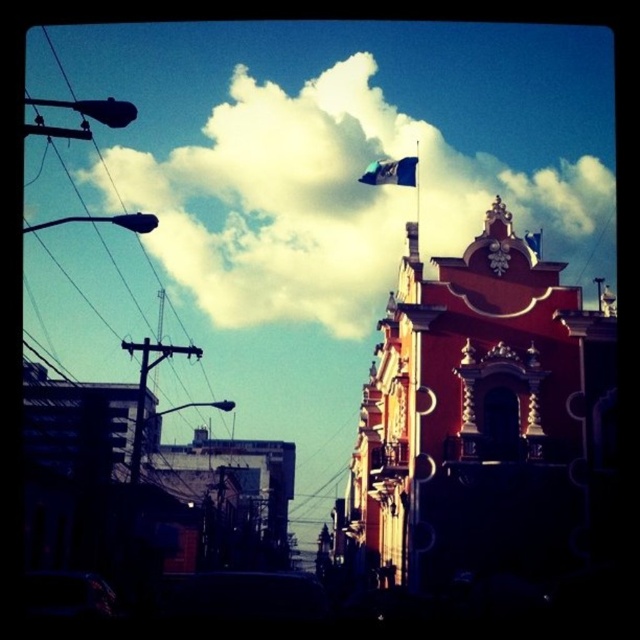
Question: Which of the following is the closest to the observer?

Choices:
 (A) (138, 464)
 (B) (538, 168)
 (C) (401, 164)

Answer: (A)

Question: Which object is the farthest from the blue fabric flag at upper center?

Choices:
 (A) metallic pole at left
 (B) white fluffy cloud at upper center

Answer: (A)

Question: Which object appears farthest from the camera in this image?

Choices:
 (A) white fluffy cloud at upper center
 (B) metallic pole at left
 (C) blue fabric flag at upper center

Answer: (C)

Question: In this image, where is white fluffy cloud at upper center located relative to blue fabric flag at upper center?

Choices:
 (A) above
 (B) below

Answer: (A)

Question: Is white fluffy cloud at upper center wider than metallic pole at left?

Choices:
 (A) yes
 (B) no

Answer: (A)

Question: Is white fluffy cloud at upper center positioned at the back of metallic pole at left?

Choices:
 (A) no
 (B) yes

Answer: (A)